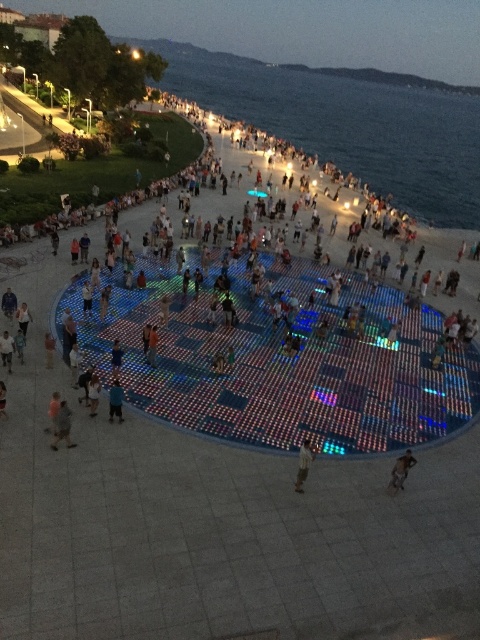
You are standing in the public square and want to take a photo of the blue water at center and the light brown leather jacket at lower left. Can you frame both in the same shot without moving your camera?

The blue water at center is located above the light brown leather jacket at lower left, so yes, you can frame both in the same shot by adjusting your camera angle to include both the upper and lower areas of the scene.